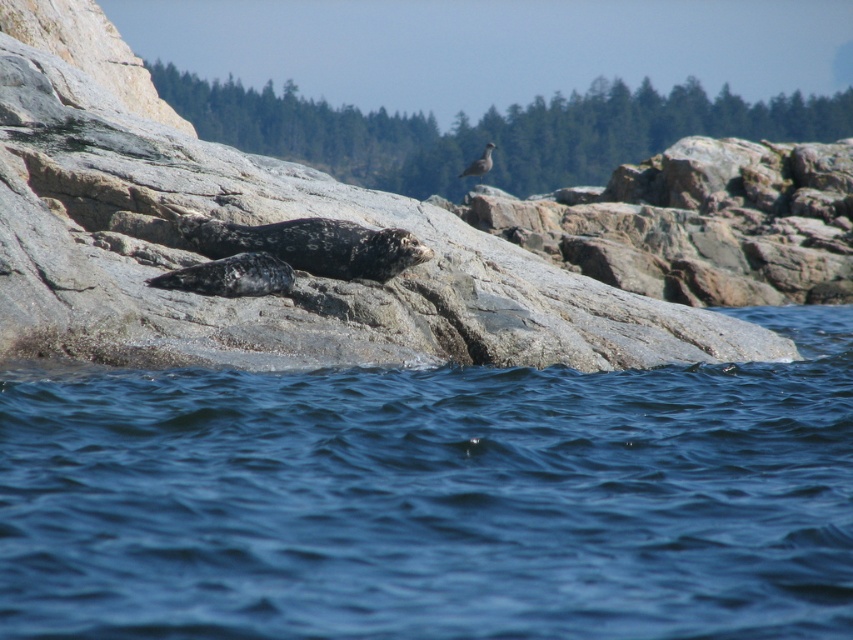
You are a photographer standing on the rocky outcrop and want to capture both the blue water at lower center and the gray feathered bird at upper center in a single shot. Based on their positions, will the bird appear above or below the water in the photo?

The gray feathered bird at upper center is above the blue water at lower center, so in the photo, the bird will appear above the water.

You are standing at the origin point of the coordinate system where the lower left corner of the image is the starting point. The image has a width of 1 unit and a height of 1 unit. You want to locate the blue water at lower center. What are the coordinates of its position?

The coordinates of the blue water at lower center are at point [434,499].

You are standing on the shore and see the blue water at lower center and the smooth gray rock at center. Which object is closer to your left side?

The blue water at lower center is closer to your left side because it is positioned to the left of the smooth gray rock at center.